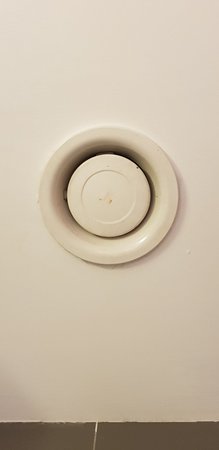
At what (x,y) coordinates should I click in order to perform the action: click on floor. Please return your answer as a coordinate pair (x, y). This screenshot has height=450, width=219. Looking at the image, I should click on click(90, 444).